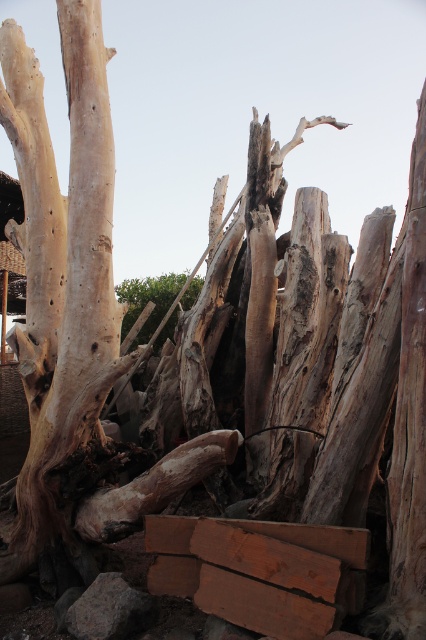
Does smooth beige wood at left appear on the left side of smooth brown wood at center?

Yes, smooth beige wood at left is to the left of smooth brown wood at center.

Locate an element on the screen. smooth beige wood at left is located at coordinates (62, 269).

Which is in front, point (39, 296) or point (131, 296)?

Positioned in front is point (39, 296).

You are a GUI agent. You are given a task and a screenshot of the screen. Output one action in this format:
    pyautogui.click(x=<x>, y=<y>)
    Task: Click on the smooth beige wood at left
    The height and width of the screenshot is (640, 426).
    Given the screenshot: What is the action you would take?
    pyautogui.click(x=62, y=269)

Locate an element on the screen. The image size is (426, 640). smooth beige wood at left is located at coordinates (62, 269).

What do you see at coordinates (62, 269) in the screenshot? The image size is (426, 640). I see `smooth beige wood at left` at bounding box center [62, 269].

Which is in front, point (86, 70) or point (224, 611)?

Positioned in front is point (224, 611).

Where is `smooth beige wood at left`? Image resolution: width=426 pixels, height=640 pixels. smooth beige wood at left is located at coordinates (62, 269).

Does brown rough wood at lower center lie behind smooth brown wood at center?

That is False.

How much distance is there between brown rough wood at lower center and smooth brown wood at center?

The distance of brown rough wood at lower center from smooth brown wood at center is 7.09 meters.

Is point (166, 536) closer to viewer compared to point (190, 289)?

Yes, point (166, 536) is in front of point (190, 289).

Image resolution: width=426 pixels, height=640 pixels. Find the location of `brown rough wood at lower center`. brown rough wood at lower center is located at coordinates (259, 572).